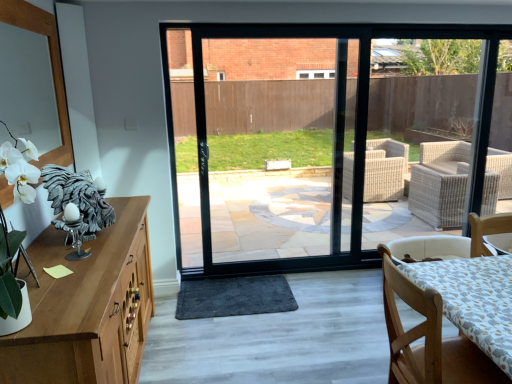
Where is `vacant point above dark gray plush mat at center (from a real-world perspective)`? The height and width of the screenshot is (384, 512). vacant point above dark gray plush mat at center (from a real-world perspective) is located at coordinates (229, 295).